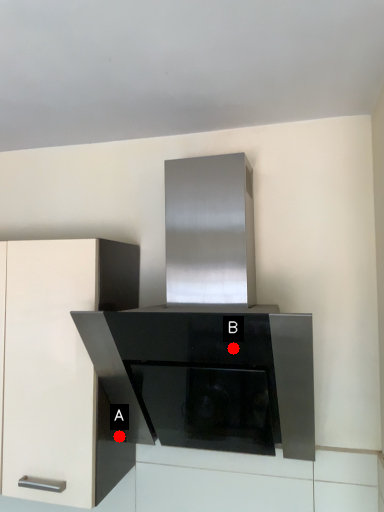
Question: Two points are circled on the image, labeled by A and B beside each circle. Which point appears closest to the camera in this image?

Choices:
 (A) A is closer
 (B) B is closer

Answer: (B)